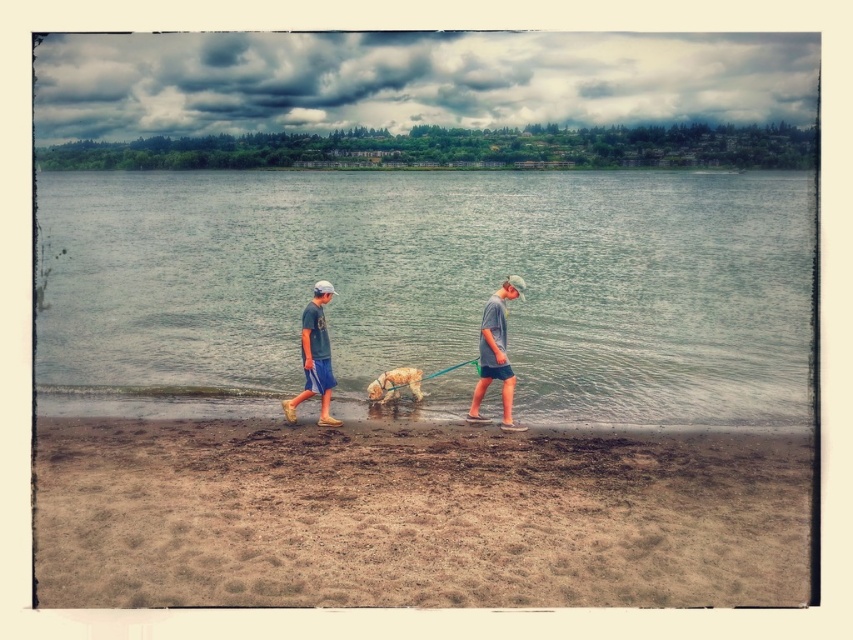
Question: Which of these objects is positioned farthest from the brown sandy beach at lower center?

Choices:
 (A) golden fur dog at center
 (B) gray matte shorts at center

Answer: (A)

Question: Which of the following is the farthest from the observer?

Choices:
 (A) click(x=77, y=230)
 (B) click(x=509, y=298)
 (C) click(x=312, y=339)

Answer: (A)

Question: Can you confirm if brown sandy beach at lower center is smaller than matte blue shorts at center?

Choices:
 (A) no
 (B) yes

Answer: (A)

Question: Based on their relative distances, which object is farther from the clear water at center?

Choices:
 (A) gray matte shorts at center
 (B) brown sandy beach at lower center

Answer: (A)

Question: Is gray matte shorts at center in front of matte blue shorts at center?

Choices:
 (A) no
 (B) yes

Answer: (B)

Question: Does brown sandy beach at lower center have a lesser width compared to gray matte shorts at center?

Choices:
 (A) no
 (B) yes

Answer: (A)